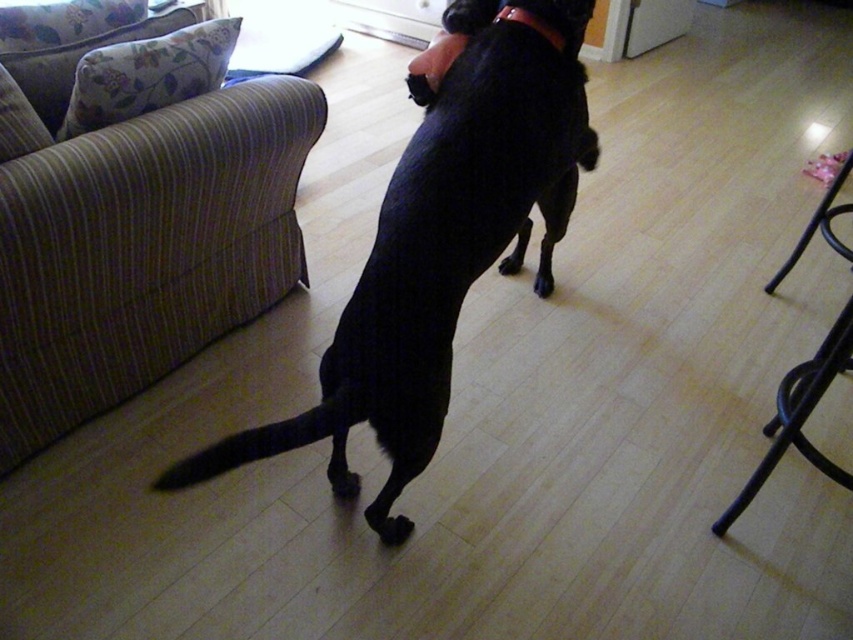
Does rubber band at upper center come in front of black fur paw at center?

Yes.

Does point (563, 38) come closer to viewer compared to point (502, 266)?

Yes.

The image size is (853, 640). I want to click on rubber band at upper center, so click(532, 22).

This screenshot has height=640, width=853. I want to click on rubber band at upper center, so click(532, 22).

Is point (495, 19) positioned behind point (546, 273)?

No, (495, 19) is in front of (546, 273).

Find the location of a particular element. rubber band at upper center is located at coordinates (532, 22).

Who is positioned more to the left, black metal stool at lower right or black fur paw at center?

Positioned to the left is black fur paw at center.

Identify the location of black metal stool at lower right. The image size is (853, 640). (799, 413).

I want to click on black metal stool at lower right, so click(799, 413).